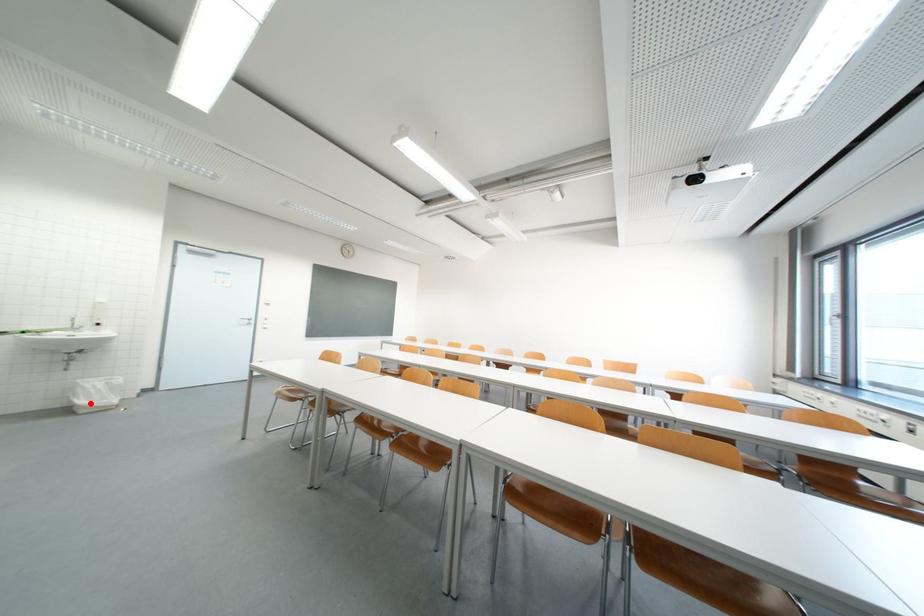
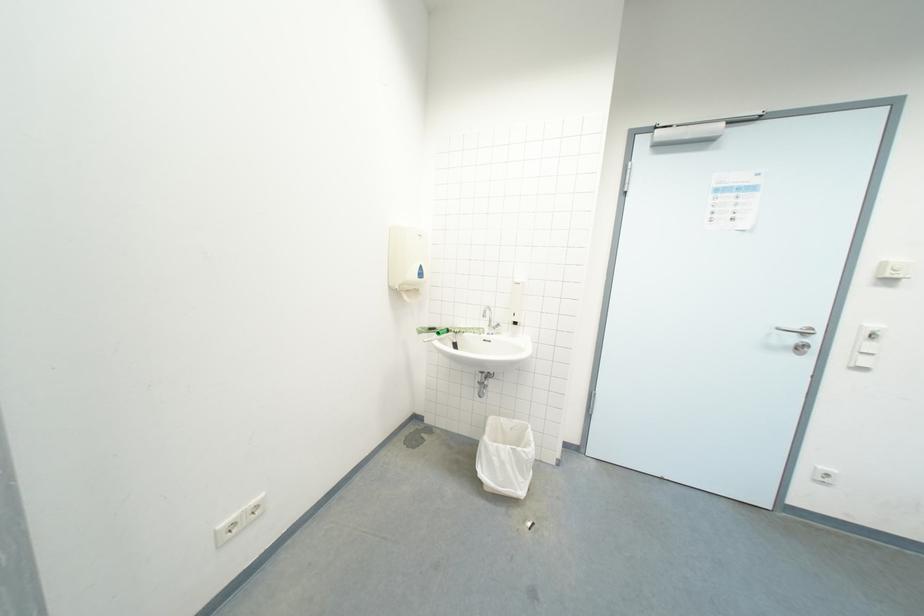
Locate, in the second image, the point that corresponds to the highlighted location in the first image.

(492, 475)